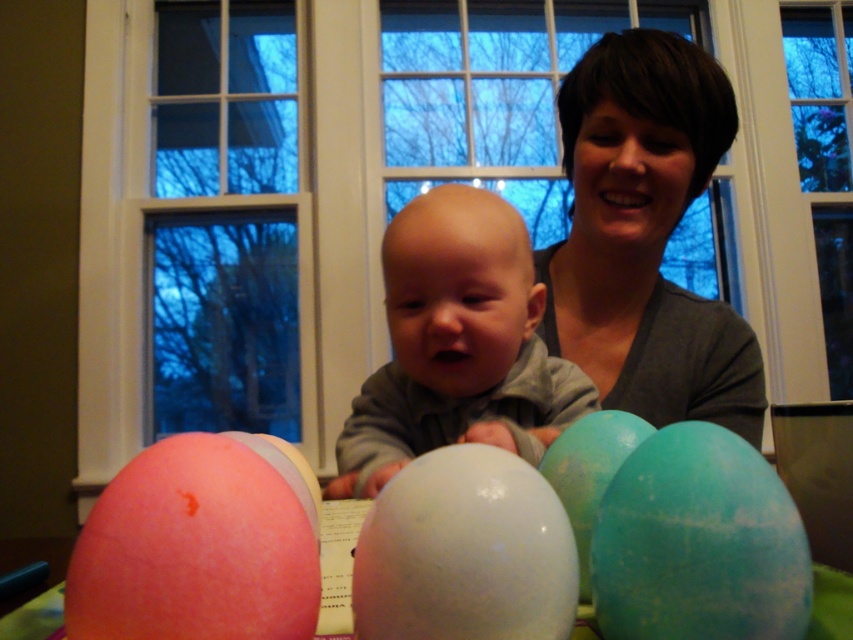
You are standing 10 inches away from the point at coordinates point (793, 545). Can you reach it without moving your feet?

The distance of point (793, 545) from viewer is 14.68 inches. Since you are only 10 inches away, you are still 4.68 inches away from the point (793, 545) and cannot reach it without moving.

In the scene shown: You are a party planner arranging decorations. You have a white glossy balloon at center and a matte teal balloon at center right. Which balloon is wider?

The white glossy balloon at center might be wider than the matte teal balloon at center right according to the description.

You are planning to decorate a party table with balloons. You have two balloons available, the green matte balloon at center and the matte teal balloon at center right. If you want to place them side by side on the table, which balloon should you place first to ensure they both fit?

The green matte balloon at center occupies less space than the matte teal balloon at center right, so you should place the larger matte teal balloon at center right first to accommodate its size, then the smaller green matte balloon at center.